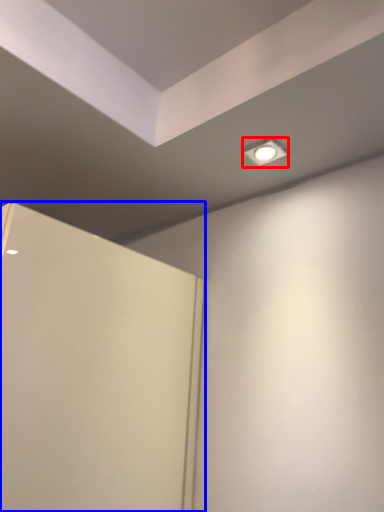
Question: Among these objects, which one is farthest to the camera, lighting (highlighted by a red box) or door (highlighted by a blue box)?

Choices:
 (A) lighting
 (B) door

Answer: (A)